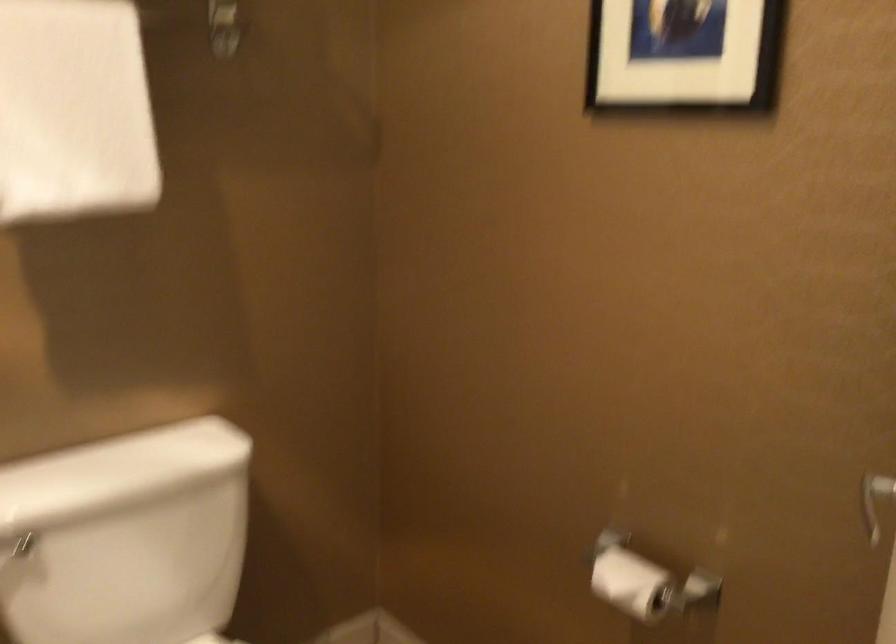
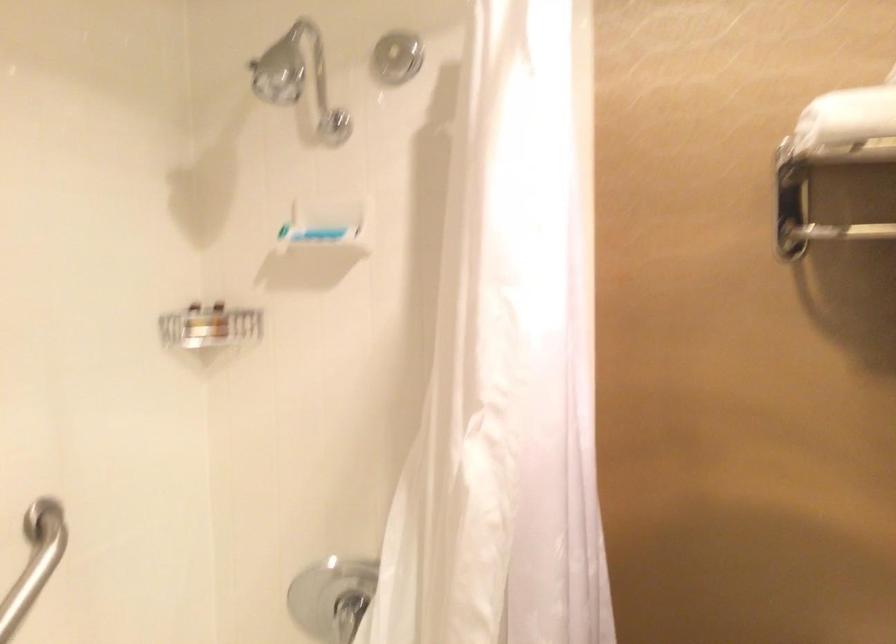
Question: The first image is from the beginning of the video and the second image is from the end. How did the camera likely rotate when shooting the video?

Choices:
 (A) Left
 (B) Right
 (C) Up
 (D) Down

Answer: (A)